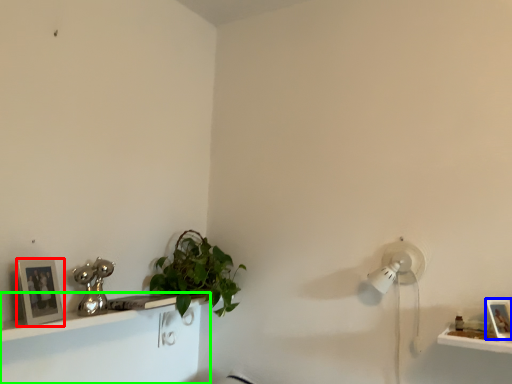
Question: Which object is the farthest from picture frame (highlighted by a red box)? Choose among these: picture frame (highlighted by a blue box) or shelf (highlighted by a green box).

Choices:
 (A) picture frame
 (B) shelf

Answer: (A)